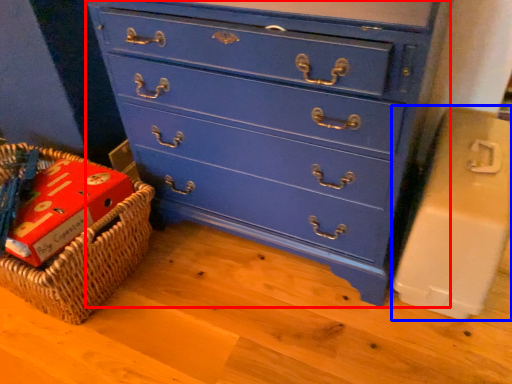
Question: Which object appears farthest to the camera in this image, chest of drawers (highlighted by a red box) or cardboard box (highlighted by a blue box)?

Choices:
 (A) chest of drawers
 (B) cardboard box

Answer: (B)